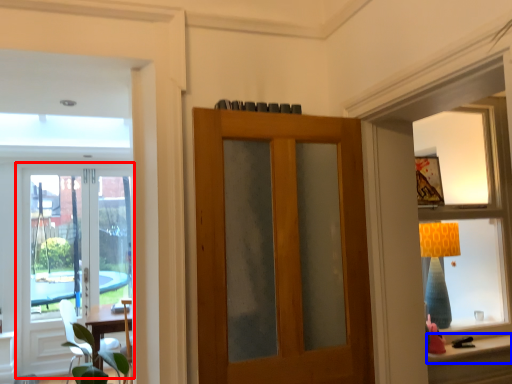
Question: Which of the following is the closest to the observer, door (highlighted by a red box) or window sill (highlighted by a blue box)?

Choices:
 (A) door
 (B) window sill

Answer: (B)